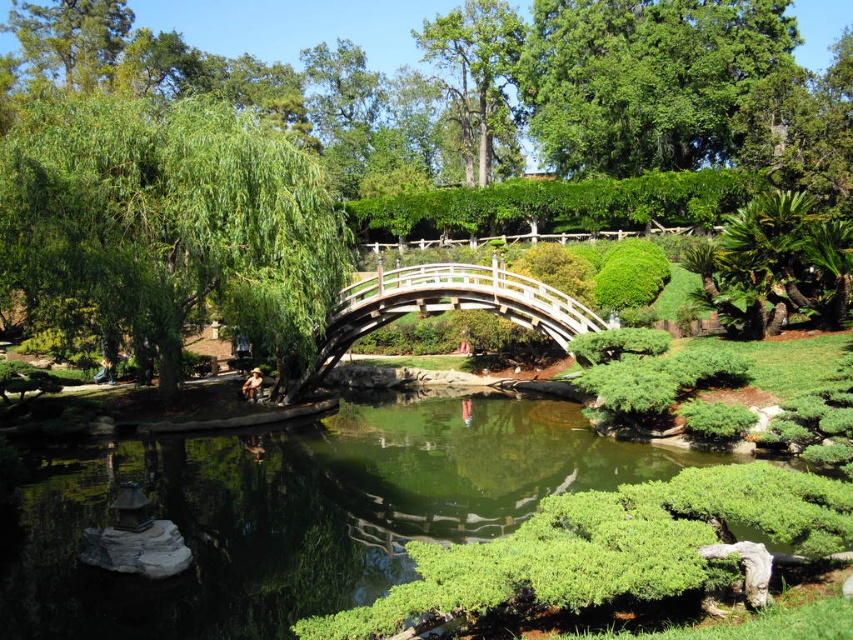
The image size is (853, 640). What do you see at coordinates (166, 224) in the screenshot?
I see `green leafy tree at left` at bounding box center [166, 224].

Which is behind, point (260, 316) or point (584, 22)?

Point (584, 22)

Which is in front, point (265, 266) or point (534, 64)?

Point (265, 266) is more forward.

You are a GUI agent. You are given a task and a screenshot of the screen. Output one action in this format:
    pyautogui.click(x=<x>, y=<y>)
    Task: Click on the green leafy tree at left
    The image size is (853, 640).
    Given the screenshot: What is the action you would take?
    pos(166,224)

Who is more forward, (141, 449) or (318, 272)?

Point (318, 272) is in front.

This screenshot has width=853, height=640. What do you see at coordinates (300, 513) in the screenshot?
I see `green reflective water at center` at bounding box center [300, 513].

Which is in front, point (213, 460) or point (303, 305)?

Point (213, 460)

The image size is (853, 640). Find the location of `green reflective water at center`. green reflective water at center is located at coordinates (300, 513).

Can you confirm if green reflective water at center is taller than green leafy tree at upper center?

Incorrect, green reflective water at center's height is not larger of green leafy tree at upper center's.

In the scene shown: Does green reflective water at center lie behind green leafy tree at upper center?

No, green reflective water at center is in front of green leafy tree at upper center.

Who is more distant from viewer, (225, 637) or (616, 12)?

The point (616, 12) is behind.

Find the location of `green reflective water at center`. green reflective water at center is located at coordinates (300, 513).